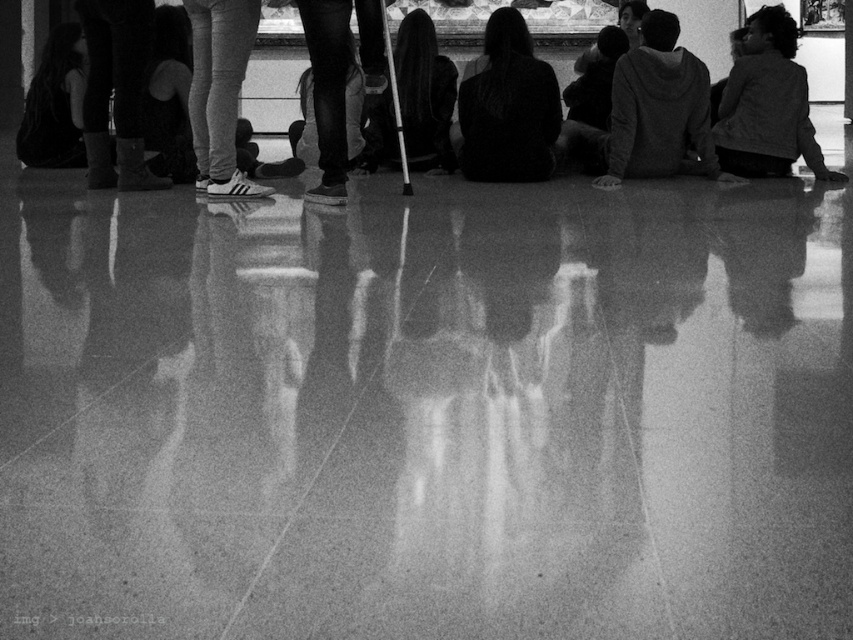
Question: Which point appears farthest from the camera in this image?

Choices:
 (A) (488, 164)
 (B) (669, 52)
 (C) (741, 170)

Answer: (A)

Question: Can you confirm if dark hair at center is bigger than dark gray hoodie at upper right?

Choices:
 (A) no
 (B) yes

Answer: (A)

Question: Does dark hair at center lie behind dark gray hoodie at upper right?

Choices:
 (A) yes
 (B) no

Answer: (A)

Question: Based on their relative distances, which object is nearer to the gray hoodie at center?

Choices:
 (A) dark hair at center
 (B) dark gray hoodie at upper right

Answer: (B)

Question: Does dark hair at center have a greater width compared to dark gray hoodie at upper right?

Choices:
 (A) no
 (B) yes

Answer: (A)

Question: Which point appears closest to the camera in this image?

Choices:
 (A) (796, 99)
 (B) (663, 116)
 (C) (523, 108)

Answer: (B)